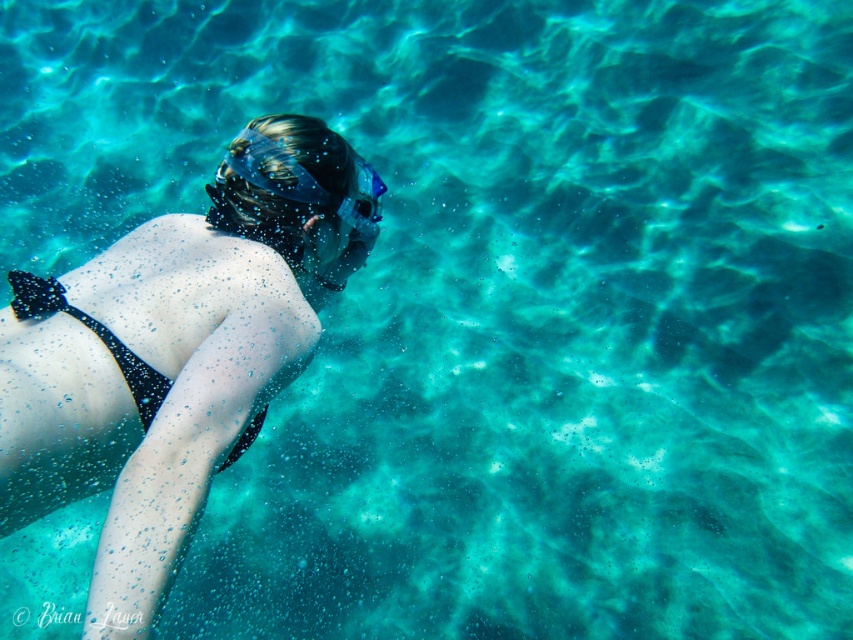
Question: Which of the following is the farthest from the observer?

Choices:
 (A) (363, 220)
 (B) (317, 236)

Answer: (A)

Question: Observing the image, what is the correct spatial positioning of matte black bikini at center in reference to black matte bikini top at lower left?

Choices:
 (A) below
 (B) above

Answer: (B)

Question: Can you confirm if matte black bikini at center is positioned below transparent blue goggles at upper center?

Choices:
 (A) no
 (B) yes

Answer: (B)

Question: Based on their relative distances, which object is farther from the transparent blue goggles at upper center?

Choices:
 (A) black matte bikini top at lower left
 (B) matte black bikini at center

Answer: (A)

Question: Which object is positioned closest to the black matte bikini top at lower left?

Choices:
 (A) transparent blue goggles at upper center
 (B) matte black bikini at center

Answer: (B)

Question: Is matte black bikini at center positioned behind black matte bikini top at lower left?

Choices:
 (A) no
 (B) yes

Answer: (A)